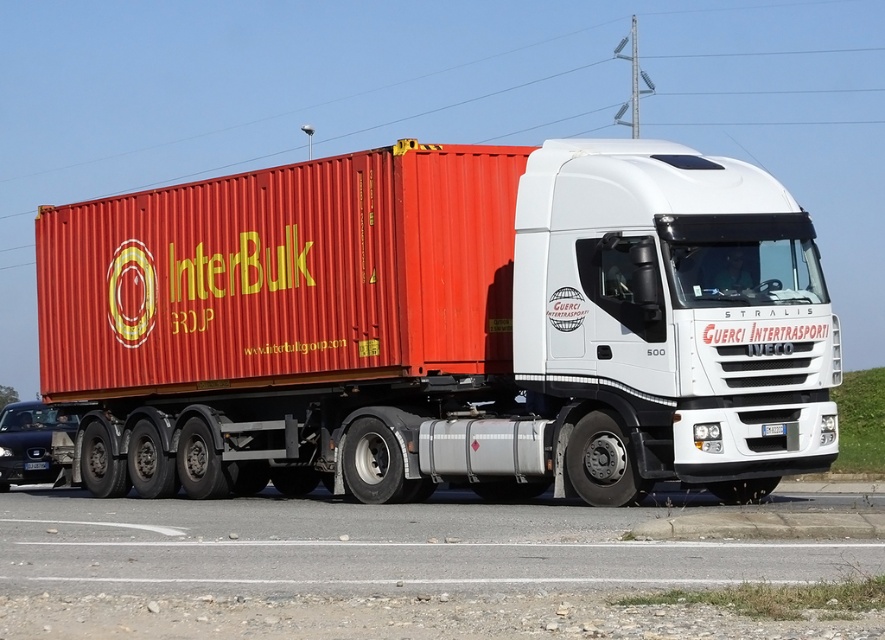
You are a photographer planning to take a photo of the metallic red shipping container at center and the metallic blue sedan at lower left. Which object should you focus on first if you want to capture both in the frame without moving the camera?

You should focus on the metallic red shipping container at center first because it is larger in size compared to the metallic blue sedan at lower left, making it more prominent in the frame.

You are standing at the center of the image. Which direction should you turn to see the metallic blue sedan at lower left?

You should turn to the left to see the metallic blue sedan at lower left because it is located at lower left direction from your current position.

You are a delivery driver who needs to confirm the vehicle registration details. You see the metallic red container at center and the white plastic license plate at center. Which object is positioned higher on the vehicle?

The metallic red container at center is above the white plastic license plate at center, so the metallic red container at center is positioned higher on the vehicle.